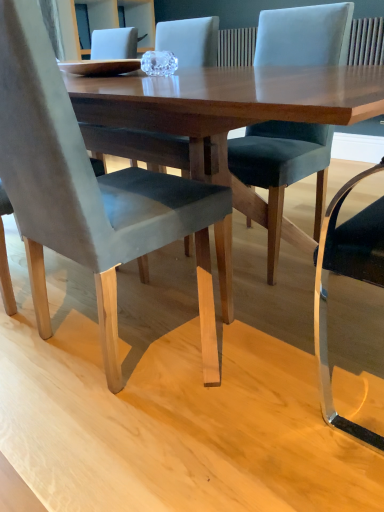
This screenshot has height=512, width=384. What are the coordinates of `vacant space underneath velvet grey chair at lower left, which is the second chair from right to left (from a real-world perspective)` in the screenshot? It's located at (138, 350).